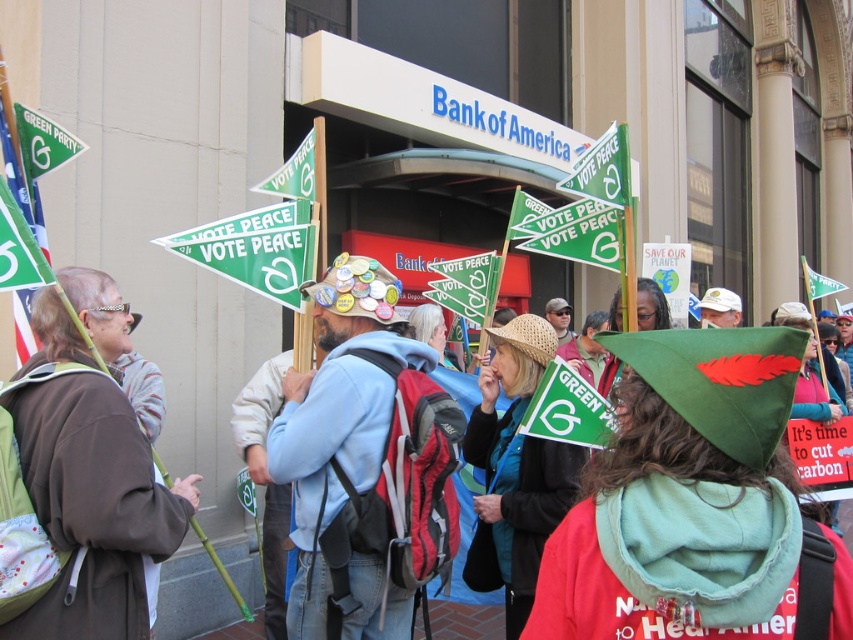
Which of these two, light blue fleece jacket at center or green paper sign at upper left, stands shorter?

green paper sign at upper left is shorter.

Can you confirm if light blue fleece jacket at center is thinner than green paper sign at upper left?

No, light blue fleece jacket at center is not thinner than green paper sign at upper left.

Locate an element on the screen. The height and width of the screenshot is (640, 853). light blue fleece jacket at center is located at coordinates (343, 449).

From the picture: Can you confirm if brown fabric robe at left is wider than light blue fleece jacket at center?

Incorrect, brown fabric robe at left's width does not surpass light blue fleece jacket at center's.

Does brown fabric robe at left appear on the right side of light blue fleece jacket at center?

Incorrect, brown fabric robe at left is not on the right side of light blue fleece jacket at center.

What do you see at coordinates (94, 506) in the screenshot?
I see `brown fabric robe at left` at bounding box center [94, 506].

This screenshot has width=853, height=640. In order to click on brown fabric robe at left in this screenshot , I will do `click(94, 506)`.

Does green felt hat at center appear on the right side of brown fabric robe at left?

Correct, you'll find green felt hat at center to the right of brown fabric robe at left.

Is green felt hat at center below brown fabric robe at left?

Incorrect, green felt hat at center is not positioned below brown fabric robe at left.

Between point (746, 614) and point (109, 520), which one is positioned behind?

The point (109, 520) is behind.

This screenshot has height=640, width=853. I want to click on green felt hat at center, so click(682, 497).